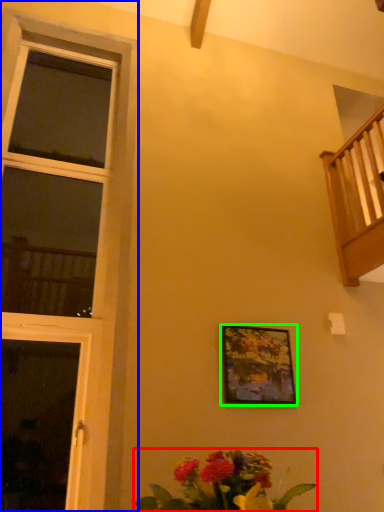
Question: Which object is the closest to the floral arrangement (highlighted by a red box)? Choose among these: window (highlighted by a blue box) or picture frame (highlighted by a green box).

Choices:
 (A) window
 (B) picture frame

Answer: (B)